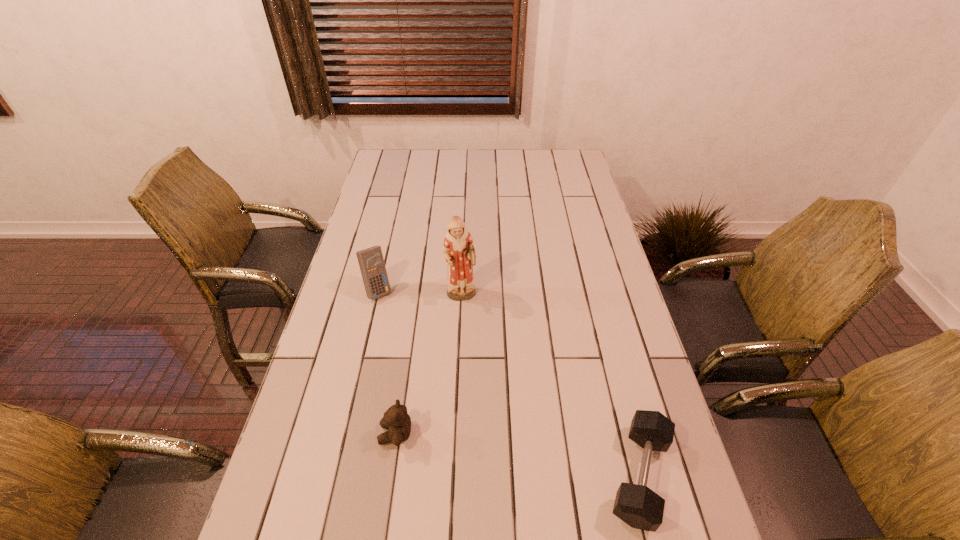
Where is `empty space between the shortest object and the figurine`? The image size is (960, 540). empty space between the shortest object and the figurine is located at coordinates (550, 386).

This screenshot has height=540, width=960. What are the coordinates of `vacant area that lies between the teddy bear and the third object from left to right` in the screenshot? It's located at (428, 365).

Find the location of a particular element. The image size is (960, 540). vacant area between the third tallest object and the leftmost object is located at coordinates click(x=387, y=362).

Where is `unoccupied position between the second object from right to left and the third tallest object`? unoccupied position between the second object from right to left and the third tallest object is located at coordinates tap(428, 365).

Where is `empty space between the figurine and the teddy bear`? This screenshot has height=540, width=960. empty space between the figurine and the teddy bear is located at coordinates (428, 365).

You are a GUI agent. You are given a task and a screenshot of the screen. Output one action in this format:
    pyautogui.click(x=<x>, y=<y>)
    Task: Click on the free spot between the second object from left to right and the shortest object
    The height and width of the screenshot is (540, 960).
    Given the screenshot: What is the action you would take?
    pyautogui.click(x=517, y=455)

Where is `vacant area that lies between the shortest object and the calculator`? The width and height of the screenshot is (960, 540). vacant area that lies between the shortest object and the calculator is located at coordinates (509, 383).

At what (x,y) coordinates should I click in order to perform the action: click on vacant area that lies between the tallest object and the leftmost object. Please return your answer as a coordinate pair (x, y). The width and height of the screenshot is (960, 540). Looking at the image, I should click on pyautogui.click(x=420, y=293).

Point out which object is positioned as the third nearest to the dumbbell. Please provide its 2D coordinates. Your answer should be formatted as a tuple, i.e. [(x, y)], where the tuple contains the x and y coordinates of a point satisfying the conditions above.

[(371, 262)]

Locate an element on the screen. This screenshot has height=540, width=960. object that is the third closest one to the third object from left to right is located at coordinates (638, 506).